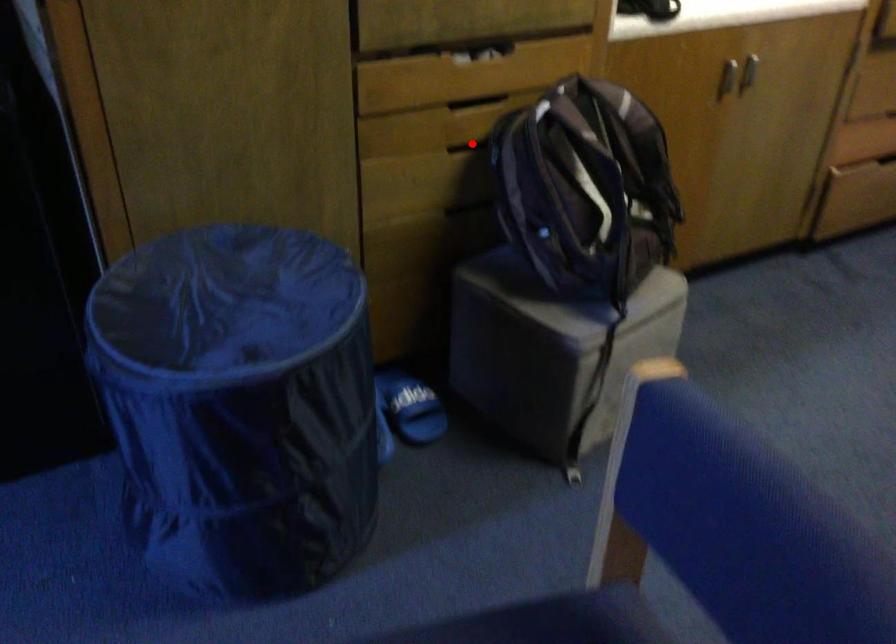
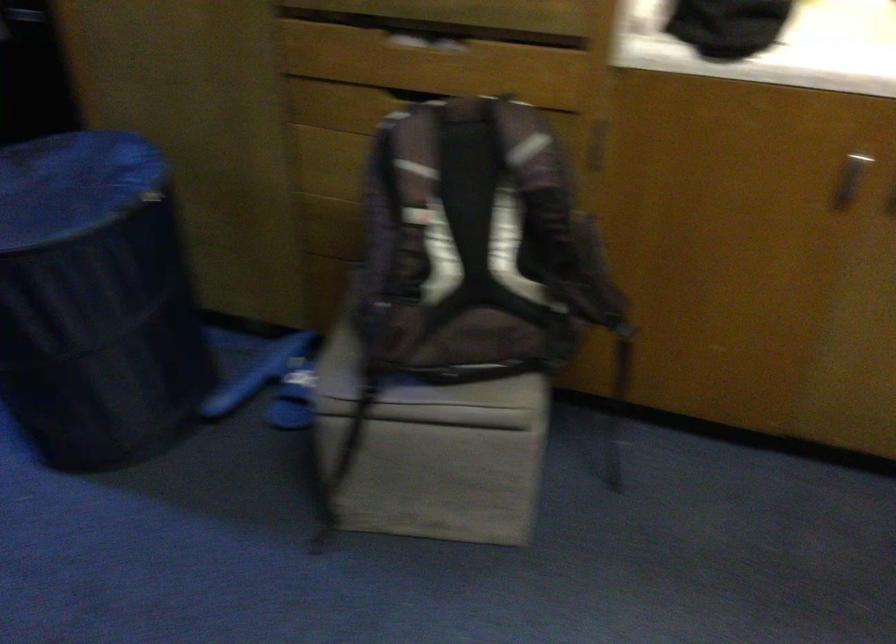
Question: I am providing you with two images of the same scene from different viewpoints. A red point is marked on the first image. Is the red point's position out of view in image 2?

Choices:
 (A) Yes
 (B) No

Answer: (A)